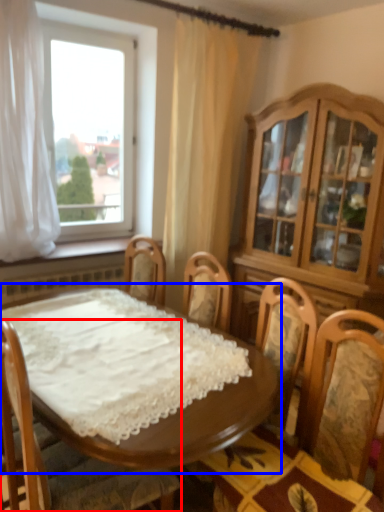
Question: Among these objects, which one is farthest to the camera, chair (highlighted by a red box) or table (highlighted by a blue box)?

Choices:
 (A) chair
 (B) table

Answer: (B)